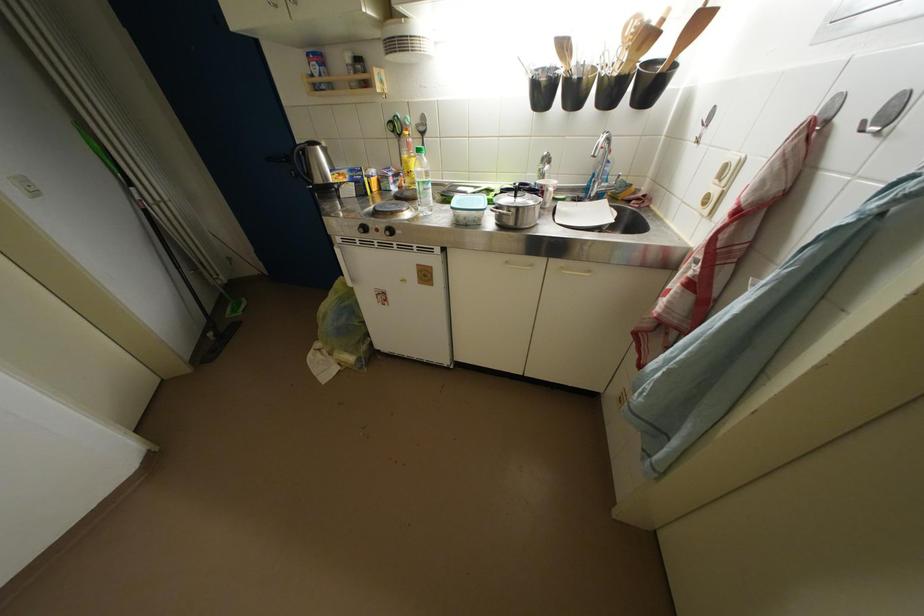
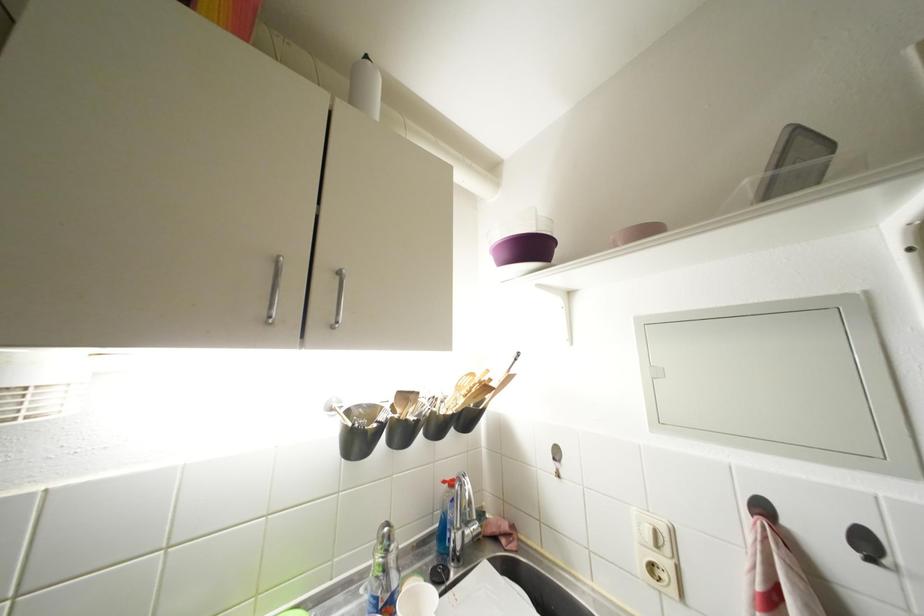
Find the pixel in the second image that matches [726,182] in the first image.

(663, 549)